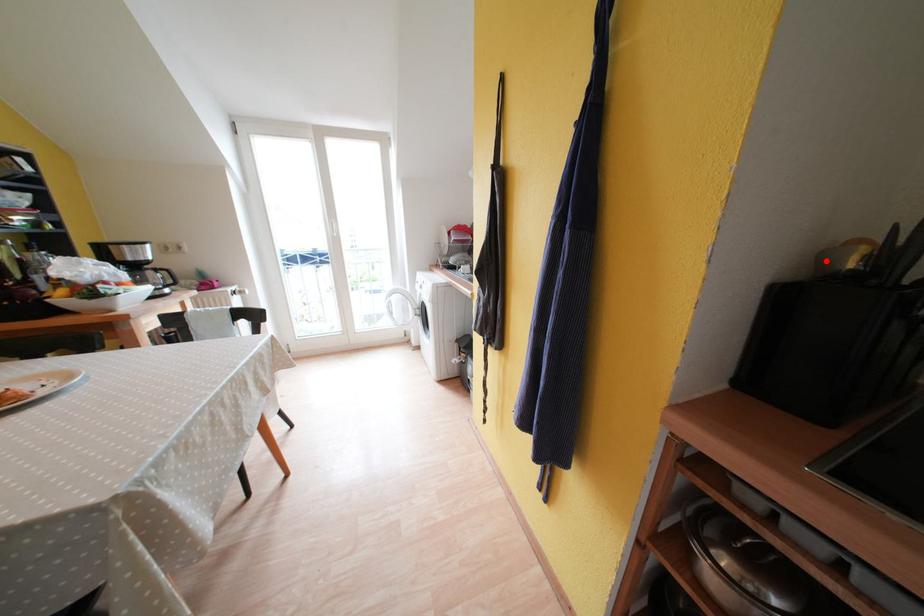
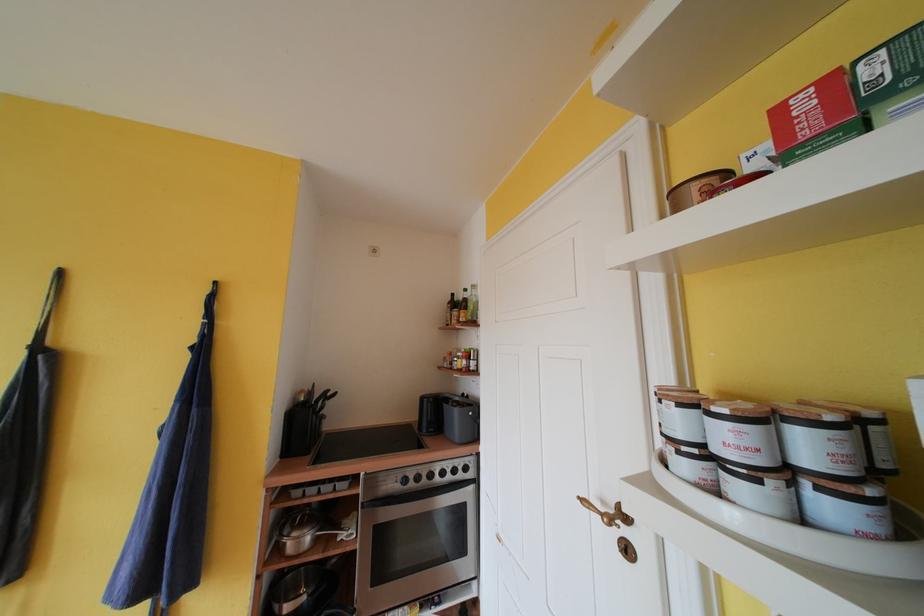
Locate, in the second image, the point that corresponds to the highlighted location in the first image.

(301, 402)